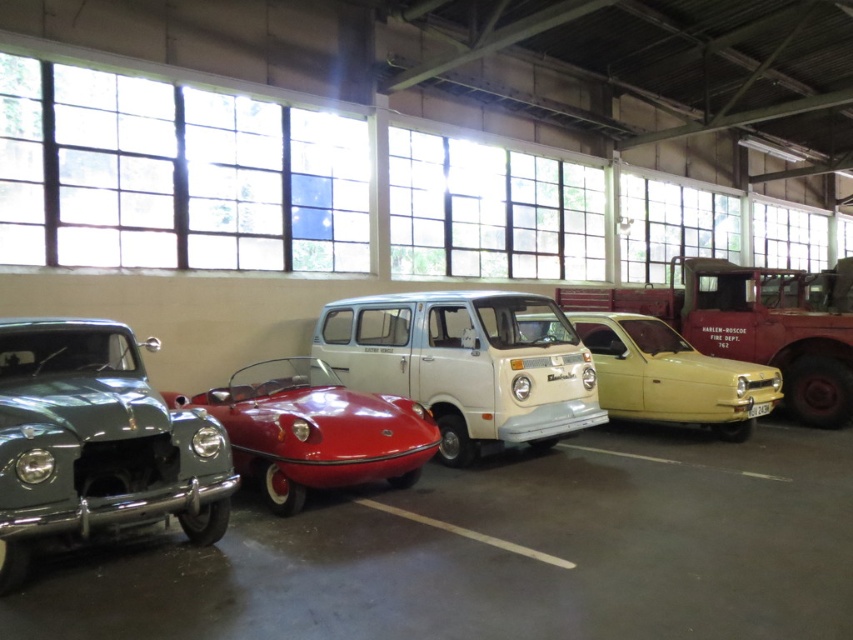
You are a delivery person trying to park a 1.5 meter wide delivery van between the shiny green car at left and the shiny red car at center. Can you fit the van between them?

The shiny green car at left and shiny red car at center are 1.41 meters apart. Since the delivery van is 1.5 meters wide, it cannot fit between them as the gap is narrower than the van.